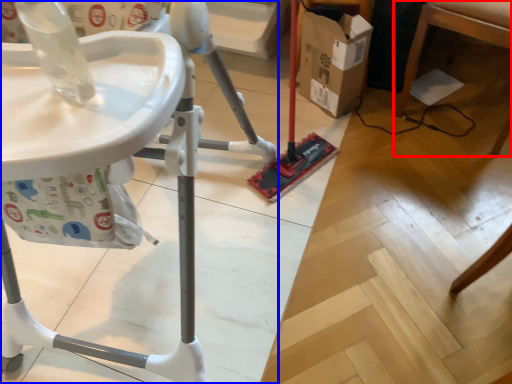
Question: Which object is closer to the camera taking this photo, furniture (highlighted by a red box) or furniture (highlighted by a blue box)?

Choices:
 (A) furniture
 (B) furniture

Answer: (B)